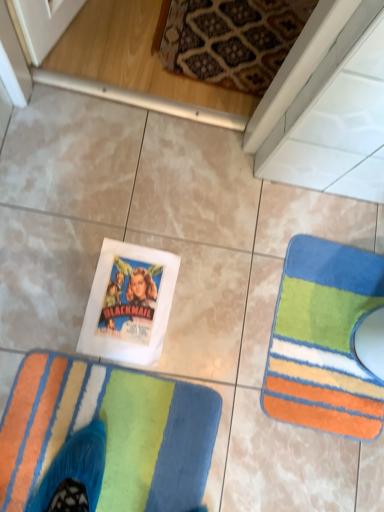
Find the location of a particular element. vacant space situated above multicolored plush rug at lower left, the second towel viewed from the back (from a real-world perspective) is located at coordinates (102, 431).